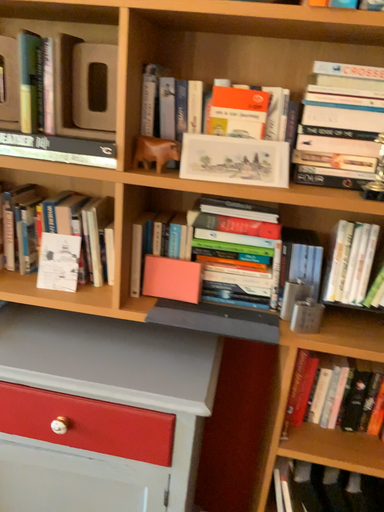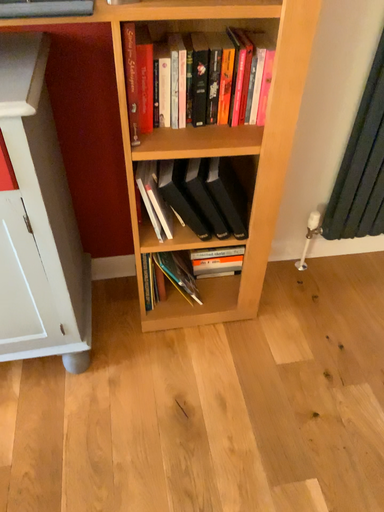
Question: How did the camera likely rotate when shooting the video?

Choices:
 (A) rotated right
 (B) rotated left

Answer: (A)